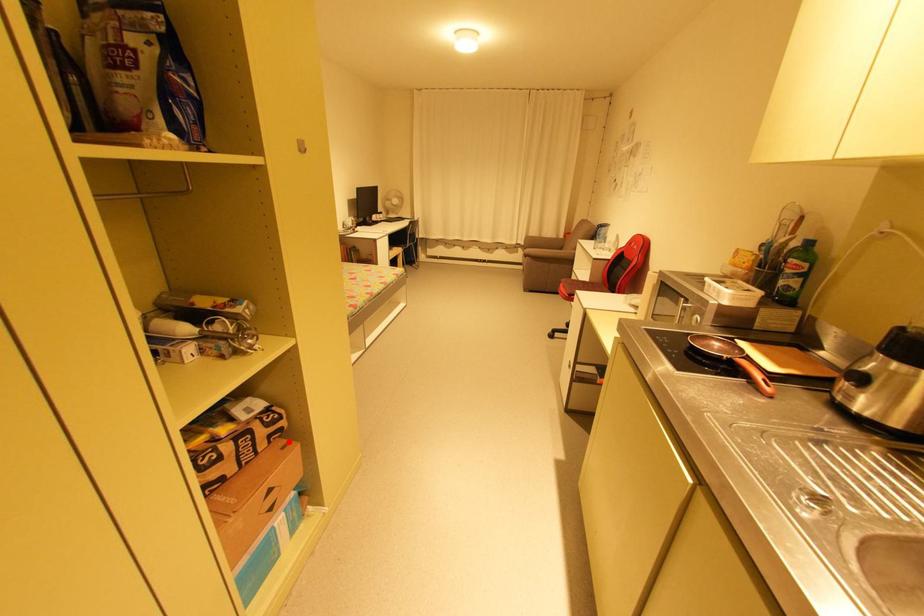
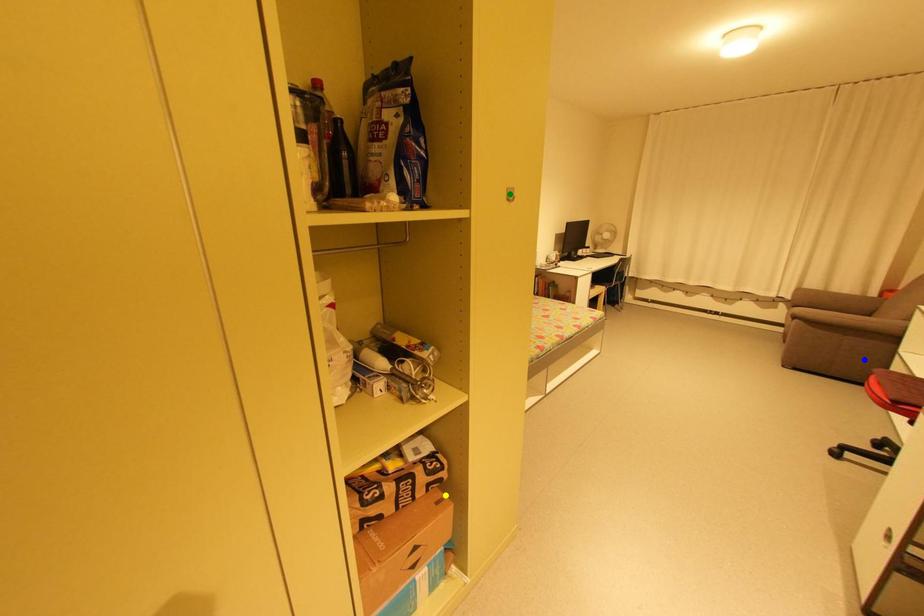
Question: I am providing you with two images of the same scene from different viewpoints. A red point is marked on the first image. You are given multiple points on the second image. Which point in image 2 represents the same 3d spot as the red point in image 1?

Choices:
 (A) blue point
 (B) green point
 (C) yellow point

Answer: (C)